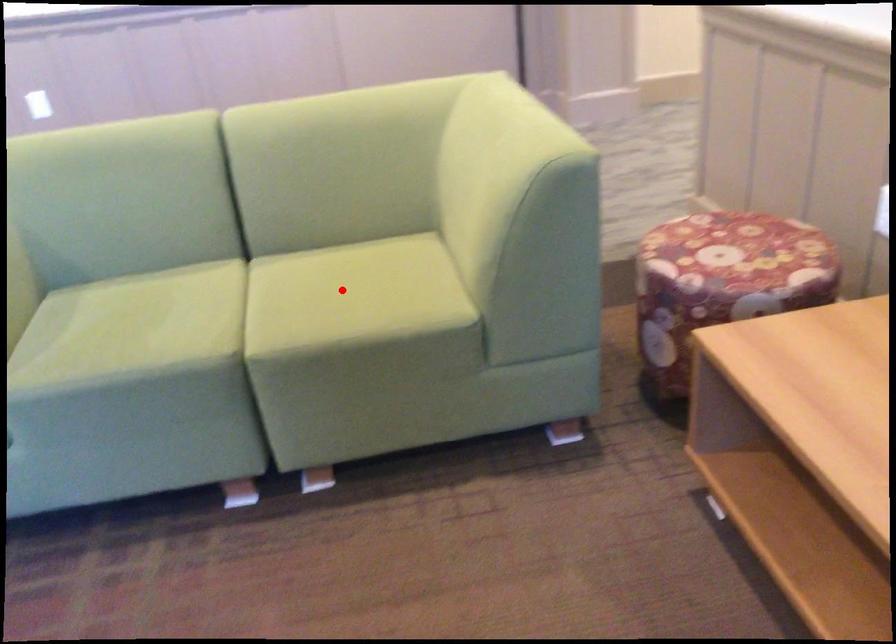
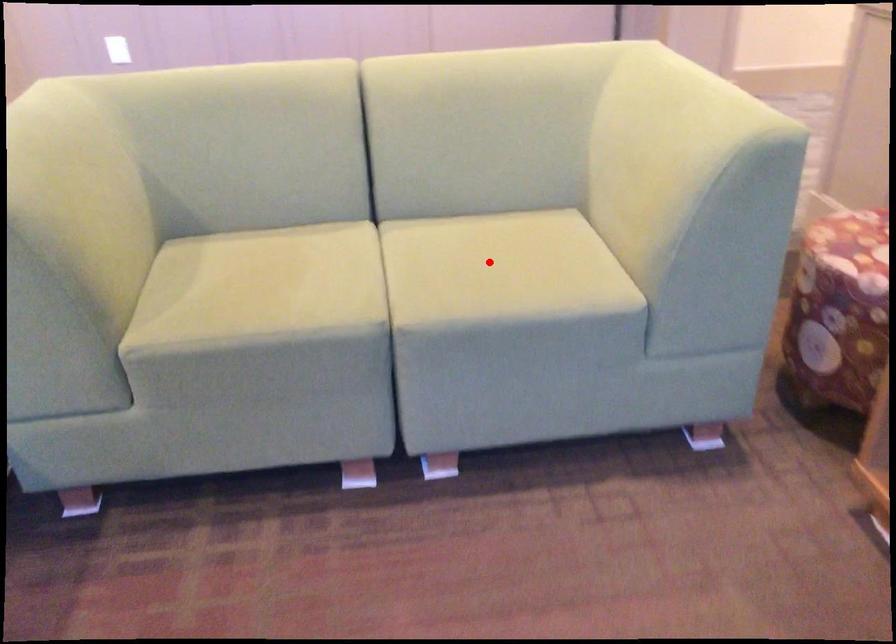
I am providing you with two images of the same scene from different viewpoints. A red point is marked on the first image and another point is marked on the second image. Are the points marked in image1 and image2 representing the same 3D position?

Yes